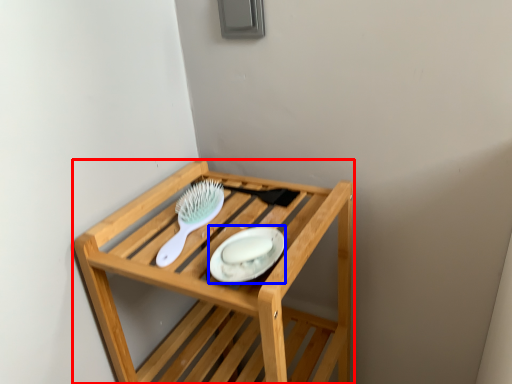
Question: Among these objects, which one is farthest to the camera, furniture (highlighted by a red box) or platter (highlighted by a blue box)?

Choices:
 (A) furniture
 (B) platter

Answer: (B)